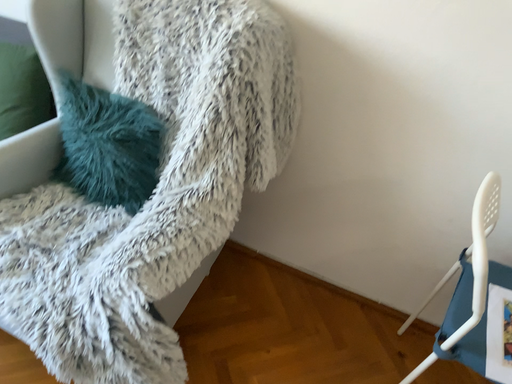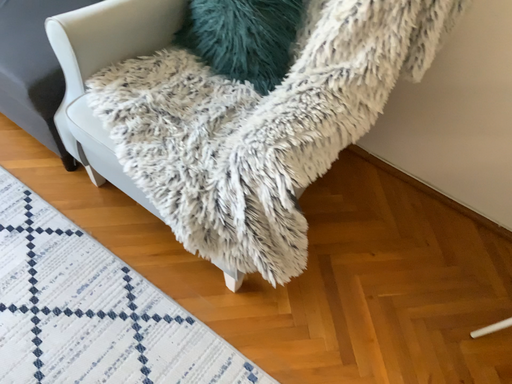
Question: Which way did the camera rotate in the video?

Choices:
 (A) rotated upward
 (B) rotated downward

Answer: (B)